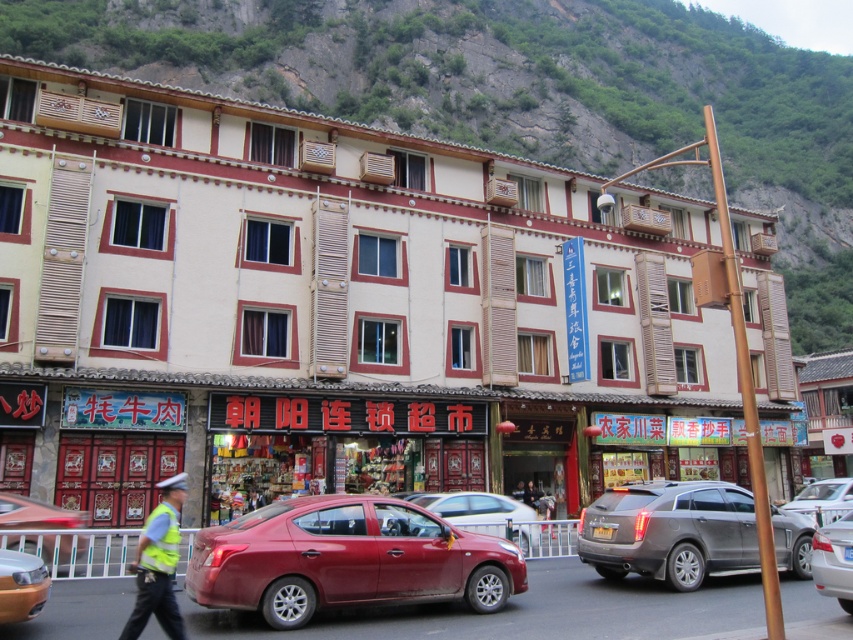
You are a delivery person who needs to deliver a package to the building in the image. You have a reflective silver helmet at center and a green rock at upper center in your line of sight. Which object is closer to you as you approach the building?

The green rock at upper center is closer to you because the reflective silver helmet at center is behind it, meaning the green rock is in front.

You are a delivery person standing at the entrance of the building. You need to deliver a package to the black matte signboard at center and then to the reflective yellow vest at center. Can you walk directly from one to the other without detouring around any obstacles?

The distance between the black matte signboard at center and reflective yellow vest at center is 6.37 meters. Since there are no obstacles mentioned in the scene description, you can walk directly between them without detouring.

You are a delivery person who needs to park your 1.8 meters tall delivery cart near the shiny red sedan at lower left and the yellow reflective vest at center. Which object should you park the cart next to to ensure it fits vertically?

The shiny red sedan at lower left is much taller than the yellow reflective vest at center, so you should park the cart next to the yellow reflective vest at center since it requires less vertical space.